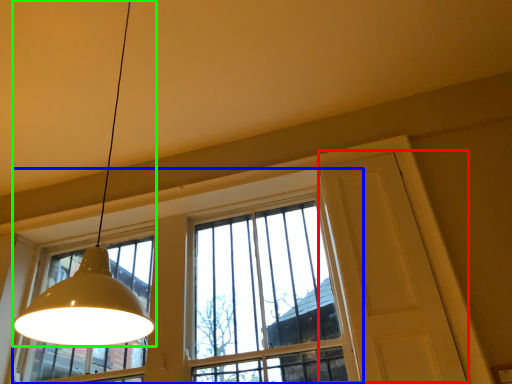
Question: Based on their relative distances, which object is farther from screen door (highlighted by a red box)? Choose from window (highlighted by a blue box) and lamp (highlighted by a green box).

Choices:
 (A) window
 (B) lamp

Answer: (B)